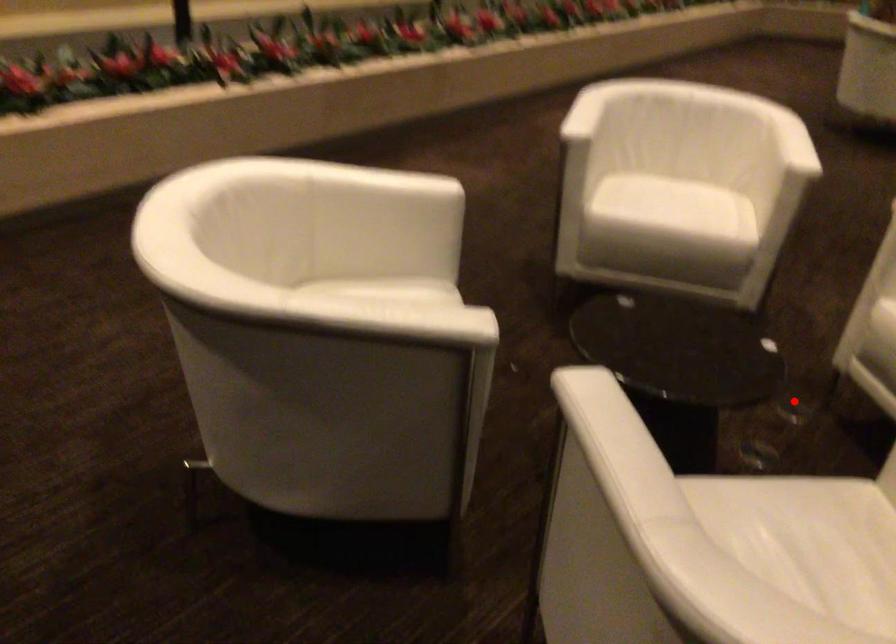
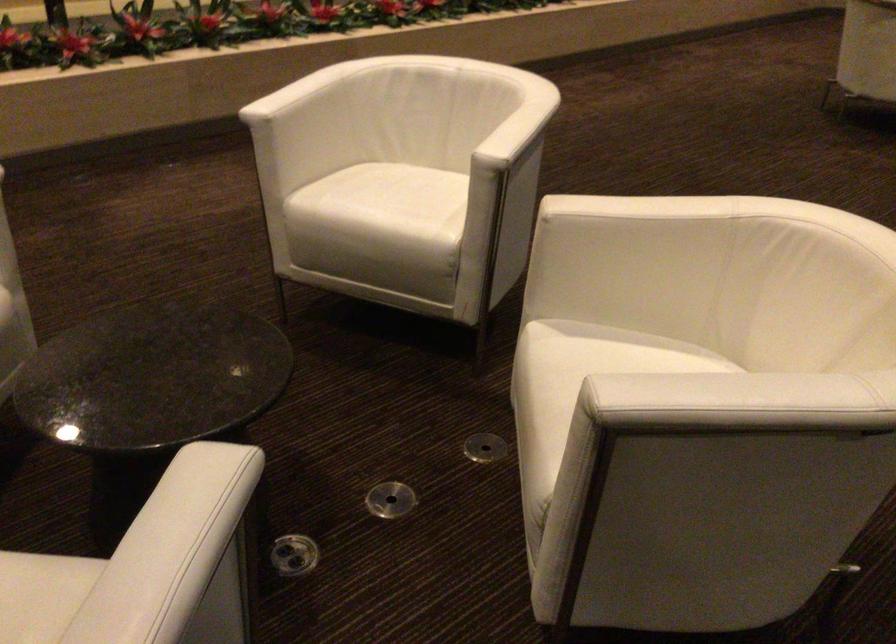
The point at the highlighted location is marked in the first image. Where is the corresponding point in the second image?

(484, 447)